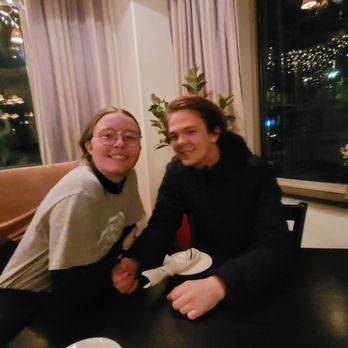
Locate an element on the screen. The height and width of the screenshot is (348, 348). purple curtain is located at coordinates (58, 89).